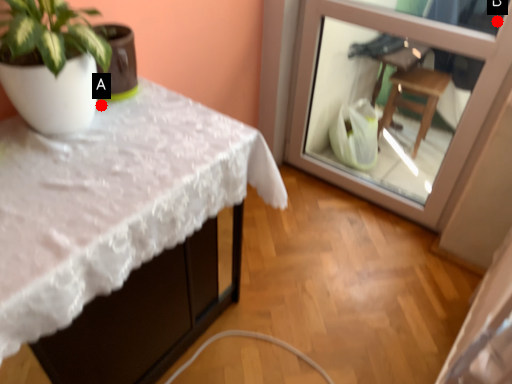
Question: Two points are circled on the image, labeled by A and B beside each circle. Which of the following is the farthest from the observer?

Choices:
 (A) A is further
 (B) B is further

Answer: (B)